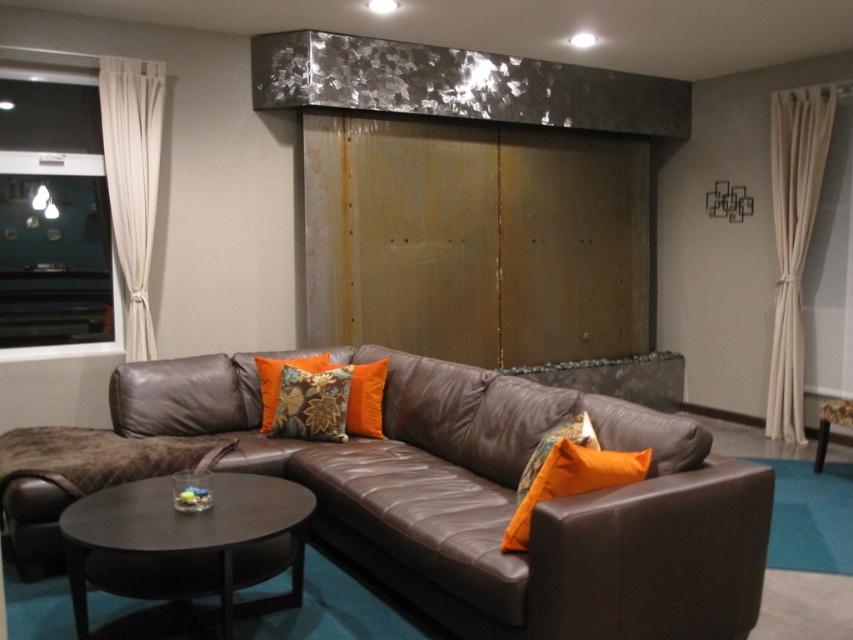
Question: Based on their relative distances, which object is farther from the orange fabric pillow at lower right?

Choices:
 (A) dark brown wood coffee table at center
 (B) orange textured pillow at center
 (C) floral-patterned fabric pillow at center

Answer: (C)

Question: Which point appears closest to the camera in this image?

Choices:
 (A) (555, 432)
 (B) (369, 380)
 (C) (567, 522)

Answer: (C)

Question: Which of the following is the closest to the observer?

Choices:
 (A) orange textured pillow at center
 (B) floral-patterned fabric pillow at center
 (C) dark brown wood coffee table at center
 (D) white fabric curtain at left

Answer: (C)

Question: Can you confirm if floral-patterned fabric pillow at center is positioned to the left of orange textured pillow at center?

Choices:
 (A) no
 (B) yes

Answer: (B)

Question: Is brown leather couch at center bigger than orange fabric pillow at center?

Choices:
 (A) yes
 (B) no

Answer: (A)

Question: Can you confirm if brown leather couch at center is positioned below orange fabric pillow at center?

Choices:
 (A) no
 (B) yes

Answer: (B)